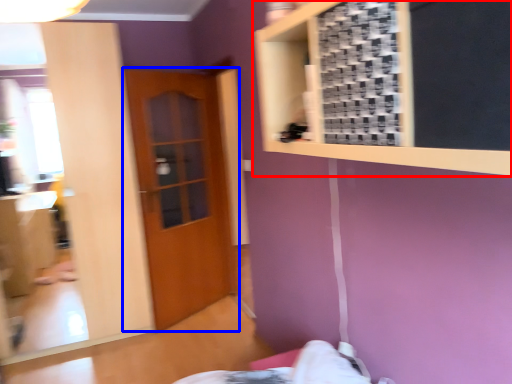
Question: Among these objects, which one is nearest to the camera, bulletin board (highlighted by a red box) or door (highlighted by a blue box)?

Choices:
 (A) bulletin board
 (B) door

Answer: (A)